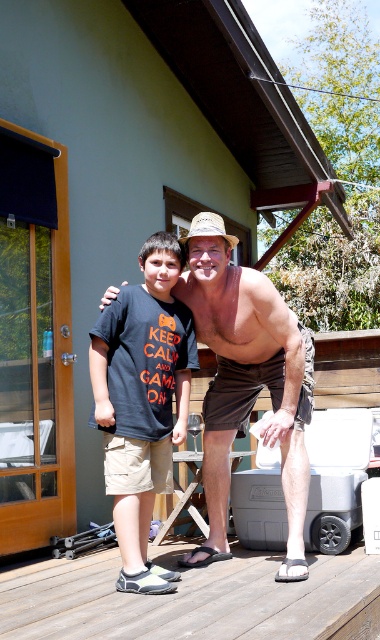
You are designing a new layout for a home decor magazine and need to compare the visual impact of the brown wooden deck at lower center and the brown cotton shorts at center in the image. Based on their spatial presence, which object takes up more visual space in the scene?

The brown cotton shorts at center takes up more visual space than the brown wooden deck at lower center because the brown wooden deck at lower center occupies less space than brown cotton shorts at center.